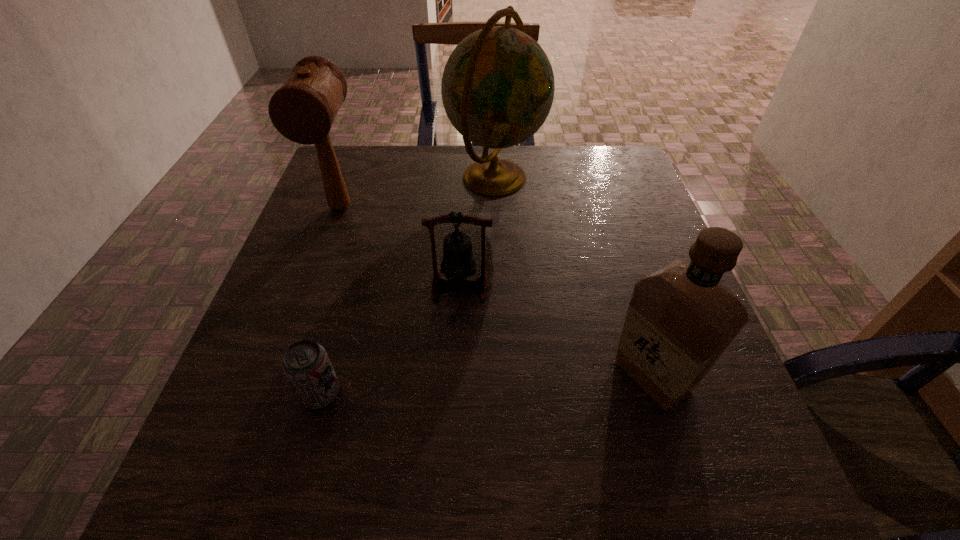
I want to click on vacant point that satisfies the following two spatial constraints: 1. on the strike surface of the shortest object; 2. on the left side of the mallet, so click(274, 394).